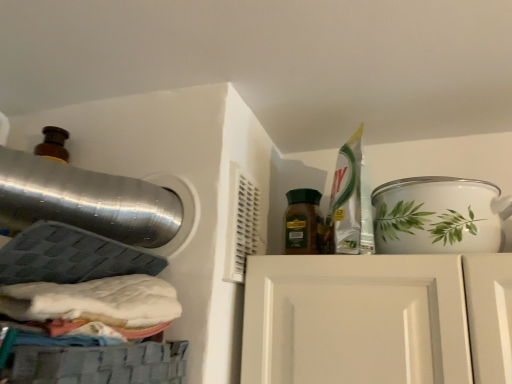
Question: Considering the relative positions of green matte jar at center and white ceramic pot at upper right in the image provided, is green matte jar at center to the left or to the right of white ceramic pot at upper right?

Choices:
 (A) left
 (B) right

Answer: (A)

Question: Is green matte jar at center spatially inside white ceramic pot at upper right, or outside of it?

Choices:
 (A) inside
 (B) outside

Answer: (B)

Question: In terms of height, does green matte jar at center look taller or shorter compared to white ceramic pot at upper right?

Choices:
 (A) tall
 (B) short

Answer: (A)

Question: Does point (390, 182) appear closer or farther from the camera than point (312, 195)?

Choices:
 (A) closer
 (B) farther

Answer: (A)

Question: Is white ceramic pot at upper right in front of or behind green matte jar at center in the image?

Choices:
 (A) behind
 (B) front

Answer: (B)

Question: Considering the positions of white ceramic pot at upper right and green matte jar at center in the image, is white ceramic pot at upper right wider or thinner than green matte jar at center?

Choices:
 (A) thin
 (B) wide

Answer: (B)

Question: From the image's perspective, is white ceramic pot at upper right located above or below green matte jar at center?

Choices:
 (A) above
 (B) below

Answer: (B)